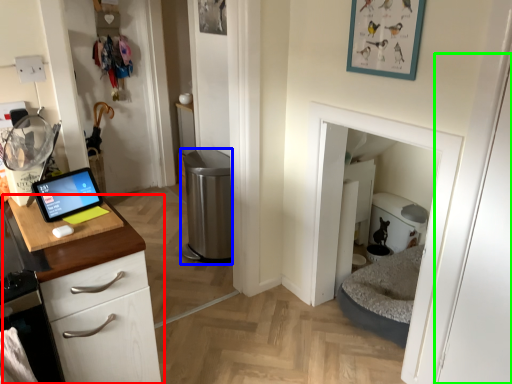
Question: Based on their relative distances, which object is nearer to cabinetry (highlighted by a red box)? Choose from appliance (highlighted by a blue box) and door (highlighted by a green box).

Choices:
 (A) appliance
 (B) door

Answer: (B)